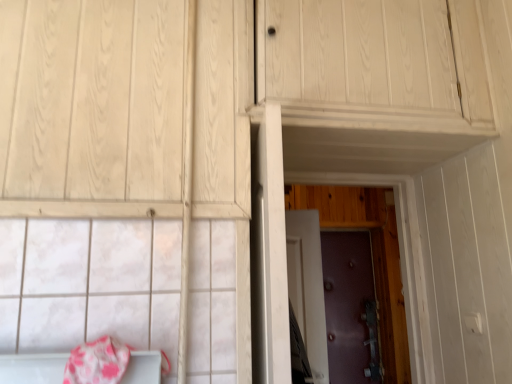
Question: Does purple matte door at center, the second door from the back, contain purple textured door at center, arranged as the 3th door when viewed from the back?

Choices:
 (A) no
 (B) yes

Answer: (A)

Question: Is purple textured door at center, arranged as the 3th door when viewed from the back, at the back of purple matte door at center, the second door from the back?

Choices:
 (A) no
 (B) yes

Answer: (A)

Question: Does purple matte door at center, the second door from the back, have a larger size compared to purple textured door at center, arranged as the 3th door when viewed from the back?

Choices:
 (A) no
 (B) yes

Answer: (A)

Question: Can you confirm if purple matte door at center, the second door from the back, is positioned to the left of purple textured door at center, arranged as the first door when viewed from the front?

Choices:
 (A) yes
 (B) no

Answer: (A)

Question: Considering the relative sizes of purple matte door at center, the second door viewed from the front, and purple textured door at center, arranged as the 3th door when viewed from the back, in the image provided, is purple matte door at center, the second door viewed from the front, wider than purple textured door at center, arranged as the 3th door when viewed from the back,?

Choices:
 (A) no
 (B) yes

Answer: (B)

Question: From the image's perspective, is pink fabric blanket at lower left positioned above or below purple textured door at center, arranged as the 3th door when viewed from the back?

Choices:
 (A) above
 (B) below

Answer: (B)

Question: Looking at the image, does pink fabric blanket at lower left seem bigger or smaller compared to purple textured door at center, arranged as the 3th door when viewed from the back?

Choices:
 (A) small
 (B) big

Answer: (A)

Question: From a real-world perspective, is pink fabric blanket at lower left above or below purple textured door at center, arranged as the 3th door when viewed from the back?

Choices:
 (A) below
 (B) above

Answer: (A)

Question: Considering the positions of point (96, 359) and point (390, 336), is point (96, 359) closer or farther from the camera than point (390, 336)?

Choices:
 (A) farther
 (B) closer

Answer: (B)

Question: In terms of width, does purple leather door at center, marked as the third door in a front-to-back arrangement, look wider or thinner when compared to pink fabric blanket at lower left?

Choices:
 (A) thin
 (B) wide

Answer: (A)

Question: Is purple leather door at center, the first door positioned from the back, taller or shorter than pink fabric blanket at lower left?

Choices:
 (A) short
 (B) tall

Answer: (B)

Question: From a real-world perspective, is purple leather door at center, the first door positioned from the back, above or below pink fabric blanket at lower left?

Choices:
 (A) above
 (B) below

Answer: (B)

Question: Considering their positions, is purple leather door at center, marked as the third door in a front-to-back arrangement, located in front of or behind pink fabric blanket at lower left?

Choices:
 (A) behind
 (B) front

Answer: (A)

Question: Considering the positions of pink fabric blanket at lower left and purple leather door at center, the first door positioned from the back, in the image, is pink fabric blanket at lower left bigger or smaller than purple leather door at center, the first door positioned from the back,?

Choices:
 (A) small
 (B) big

Answer: (A)

Question: Do you think pink fabric blanket at lower left is within purple leather door at center, marked as the third door in a front-to-back arrangement, or outside of it?

Choices:
 (A) outside
 (B) inside

Answer: (A)